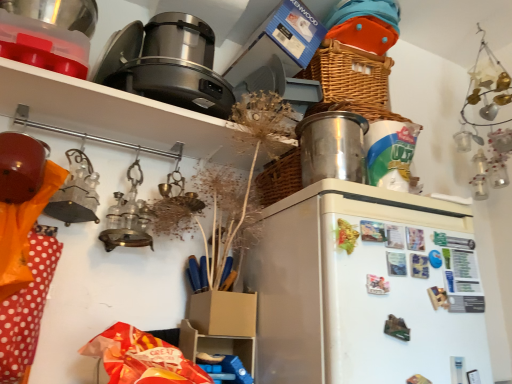
The width and height of the screenshot is (512, 384). I want to click on vacant area on top of matte black pot at upper left (from a real-world perspective), so click(x=109, y=116).